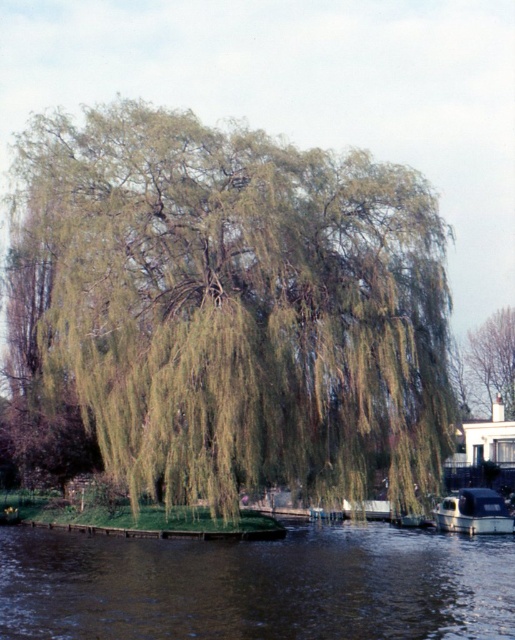
Is green leafy willow at center smaller than green leafy tree at upper right?

Actually, green leafy willow at center might be larger than green leafy tree at upper right.

Is green leafy willow at center to the left of green leafy tree at upper right from the viewer's perspective?

Indeed, green leafy willow at center is positioned on the left side of green leafy tree at upper right.

Who is more distant from viewer, (94, 336) or (510, 349)?

Positioned behind is point (510, 349).

At what (x,y) coordinates should I click in order to perform the action: click on green leafy willow at center. Please return your answer as a coordinate pair (x, y). This screenshot has width=515, height=640. Looking at the image, I should click on (231, 307).

From the picture: Between brown water at lower center and green leafy tree at upper right, which one is positioned higher?

green leafy tree at upper right is above.

Locate an element on the screen. The width and height of the screenshot is (515, 640). brown water at lower center is located at coordinates (x=258, y=586).

Is point (290, 588) less distant than point (474, 397)?

Yes.

This screenshot has width=515, height=640. I want to click on brown water at lower center, so click(258, 586).

Can you confirm if green leafy willow at center is positioned below shiny black boat at lower right?

No.

Locate an element on the screen. The image size is (515, 640). green leafy willow at center is located at coordinates (231, 307).

You are a GUI agent. You are given a task and a screenshot of the screen. Output one action in this format:
    pyautogui.click(x=<x>, y=<y>)
    Task: Click on the green leafy willow at center
    The image size is (515, 640).
    Given the screenshot: What is the action you would take?
    tap(231, 307)

What are the coordinates of `green leafy willow at center` in the screenshot? It's located at (231, 307).